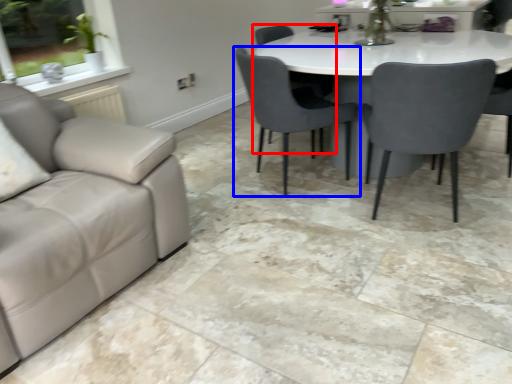
Question: Among these objects, which one is farthest to the camera, chair (highlighted by a red box) or chair (highlighted by a blue box)?

Choices:
 (A) chair
 (B) chair

Answer: (A)